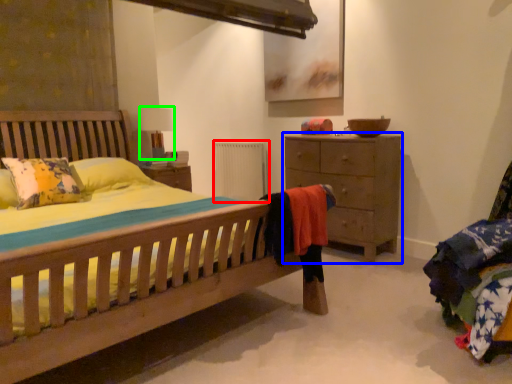
Question: Considering the real-world distances, which object is closest to radiator (highlighted by a red box)? chest of drawers (highlighted by a blue box) or table lamp (highlighted by a green box).

Choices:
 (A) chest of drawers
 (B) table lamp

Answer: (B)